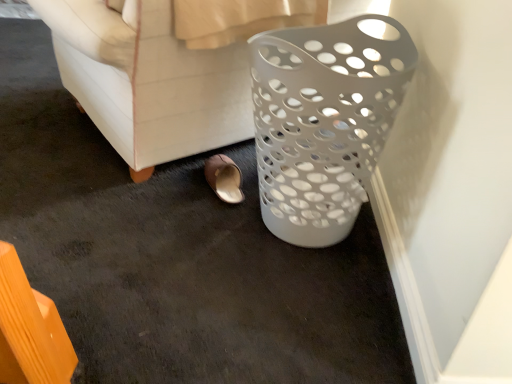
Question: Is white plastic basket at right in front of white plastic laundry basket at right?

Choices:
 (A) no
 (B) yes

Answer: (B)

Question: Can you confirm if white plastic basket at right is thinner than white plastic laundry basket at right?

Choices:
 (A) yes
 (B) no

Answer: (A)

Question: From the image's perspective, is white plastic basket at right on top of white plastic laundry basket at right?

Choices:
 (A) yes
 (B) no

Answer: (B)

Question: Does white plastic basket at right lie behind white plastic laundry basket at right?

Choices:
 (A) no
 (B) yes

Answer: (A)

Question: Does white plastic basket at right have a smaller size compared to white plastic laundry basket at right?

Choices:
 (A) yes
 (B) no

Answer: (A)

Question: Considering the positions of brown leather slipper at lower center and white plastic laundry basket at right in the image, is brown leather slipper at lower center bigger or smaller than white plastic laundry basket at right?

Choices:
 (A) small
 (B) big

Answer: (A)

Question: Considering the positions of brown leather slipper at lower center and white plastic laundry basket at right in the image, is brown leather slipper at lower center wider or thinner than white plastic laundry basket at right?

Choices:
 (A) wide
 (B) thin

Answer: (B)

Question: Does point (228, 196) appear closer or farther from the camera than point (228, 38)?

Choices:
 (A) closer
 (B) farther

Answer: (B)

Question: In terms of height, does brown leather slipper at lower center look taller or shorter compared to white plastic laundry basket at right?

Choices:
 (A) tall
 (B) short

Answer: (B)

Question: Is point (211, 52) positioned closer to the camera than point (220, 158)?

Choices:
 (A) farther
 (B) closer

Answer: (B)

Question: Based on their sizes in the image, would you say white plastic laundry basket at right is bigger or smaller than brown leather slipper at lower center?

Choices:
 (A) small
 (B) big

Answer: (B)

Question: Is white plastic laundry basket at right inside or outside of brown leather slipper at lower center?

Choices:
 (A) inside
 (B) outside

Answer: (B)

Question: Is white plastic laundry basket at right taller or shorter than brown leather slipper at lower center?

Choices:
 (A) tall
 (B) short

Answer: (A)

Question: From a real-world perspective, is white plastic basket at right physically located above or below white plastic laundry basket at right?

Choices:
 (A) above
 (B) below

Answer: (B)

Question: Considering their positions, is white plastic basket at right located in front of or behind white plastic laundry basket at right?

Choices:
 (A) behind
 (B) front

Answer: (B)